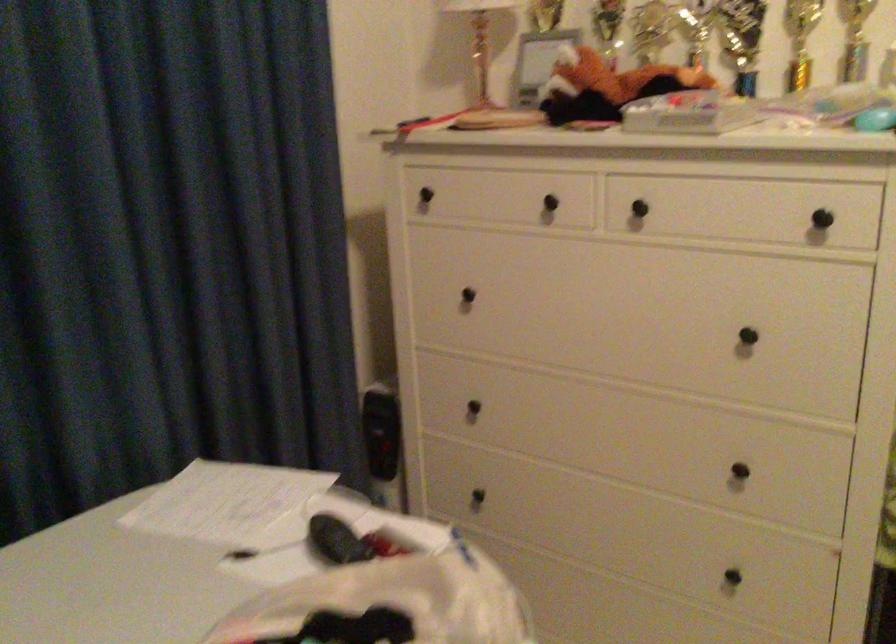
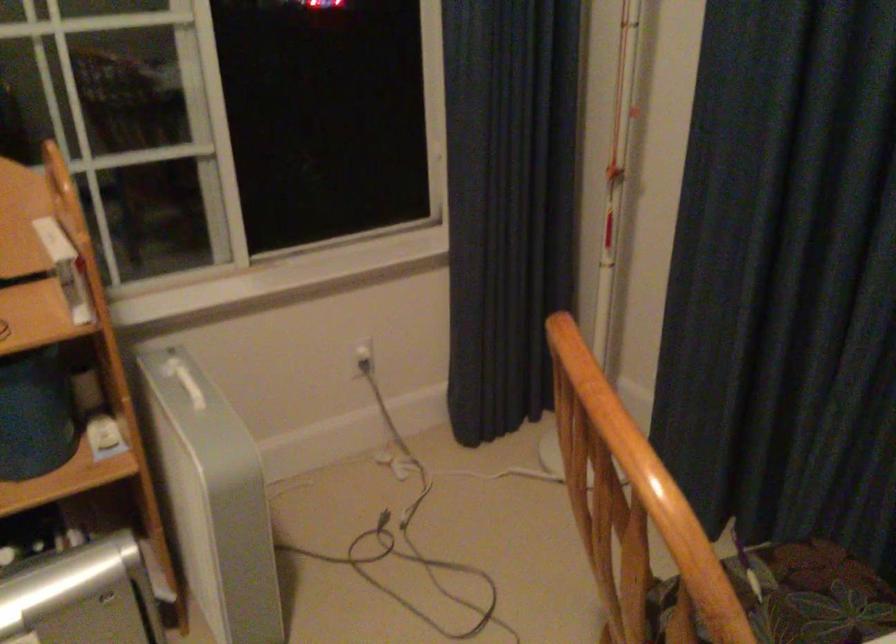
The first image is from the beginning of the video and the second image is from the end. How did the camera likely rotate when shooting the video?

The camera's rotation is toward left-down.